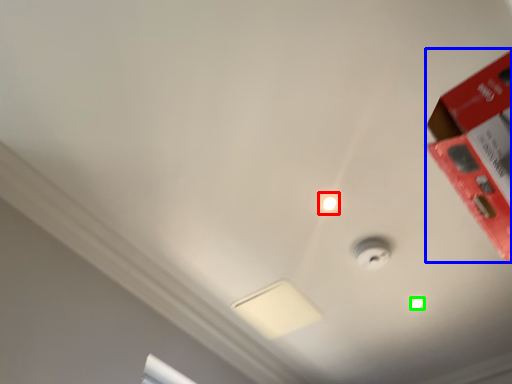
Question: Based on their relative distances, which object is nearer to droplight (highlighted by a red box)? Choose from box (highlighted by a blue box) and light bulb (highlighted by a green box).

Choices:
 (A) box
 (B) light bulb

Answer: (A)